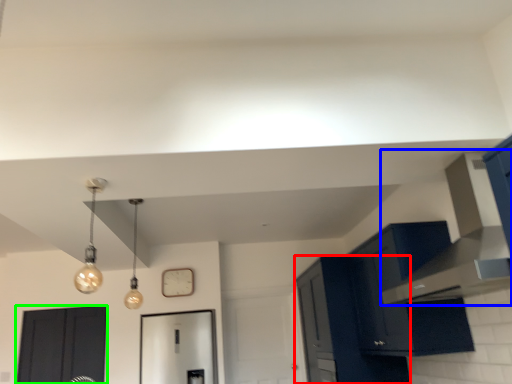
Question: Estimate the real-world distances between objects in this image. Which object is farther from cabinetry (highlighted by a red box), vent (highlighted by a blue box) or door (highlighted by a green box)?

Choices:
 (A) vent
 (B) door

Answer: (B)